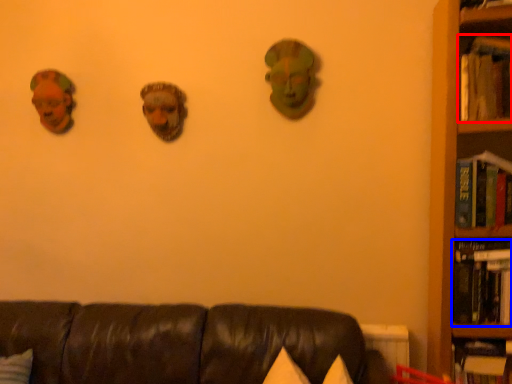
Question: Which object is closer to the camera taking this photo, book (highlighted by a red box) or book (highlighted by a blue box)?

Choices:
 (A) book
 (B) book

Answer: (A)